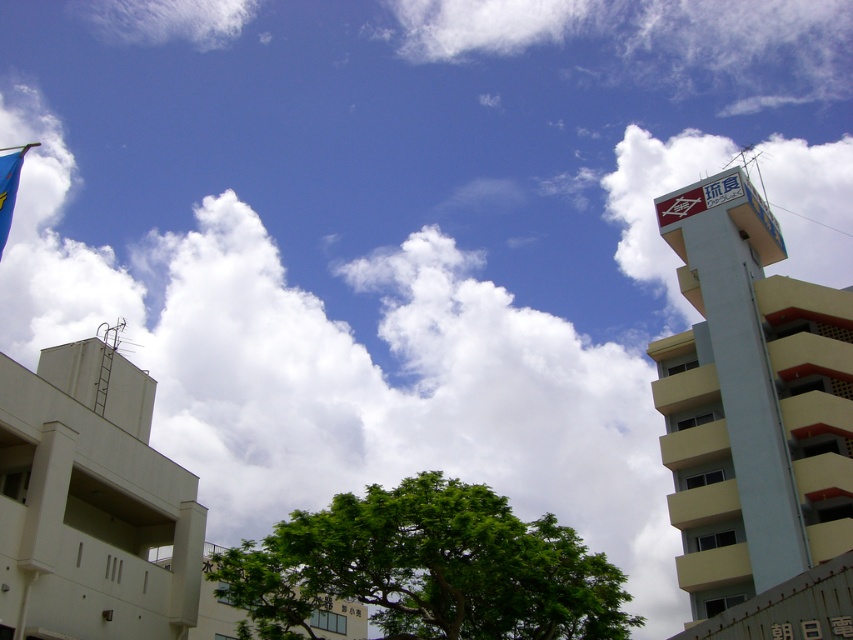
Question: Which point is farther to the camera?

Choices:
 (A) (1, 198)
 (B) (714, 568)

Answer: (B)

Question: Which of the following is the closest to the observer?

Choices:
 (A) (6, 209)
 (B) (677, 189)

Answer: (A)

Question: Does yellow matte tower at upper right appear under blue fabric flag at upper left?

Choices:
 (A) no
 (B) yes

Answer: (B)

Question: Is yellow matte tower at upper right closer to camera compared to blue fabric flag at upper left?

Choices:
 (A) no
 (B) yes

Answer: (A)

Question: Can you confirm if yellow matte tower at upper right is bigger than blue fabric flag at upper left?

Choices:
 (A) no
 (B) yes

Answer: (A)